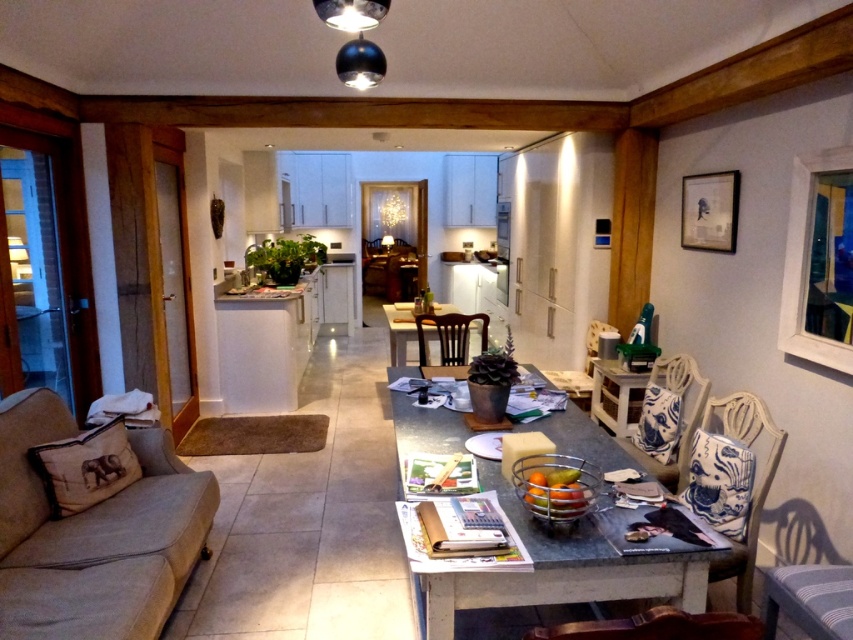
Is striped fabric chair at lower right below blue and white fabric armchair at right?

Yes, striped fabric chair at lower right is below blue and white fabric armchair at right.

Is striped fabric chair at lower right smaller than blue and white fabric armchair at right?

Correct, striped fabric chair at lower right occupies less space than blue and white fabric armchair at right.

Does point (830, 595) come farther from viewer compared to point (670, 388)?

No.

Locate an element on the screen. Image resolution: width=853 pixels, height=640 pixels. striped fabric chair at lower right is located at coordinates (811, 600).

Which is below, granite table at center or matte black picture frame at upper right?

Positioned lower is granite table at center.

Which is behind, point (660, 589) or point (688, 184)?

The point (688, 184) is more distant.

At what (x,y) coordinates should I click in order to perform the action: click on granite table at center. Please return your answer as a coordinate pair (x, y). The image size is (853, 640). Looking at the image, I should click on (560, 570).

Is granite table at center further to the viewer compared to wooden chair at lower center?

Yes.

Can you confirm if granite table at center is wider than wooden chair at lower center?

Correct, the width of granite table at center exceeds that of wooden chair at lower center.

Where is `granite table at center`? This screenshot has height=640, width=853. granite table at center is located at coordinates (560, 570).